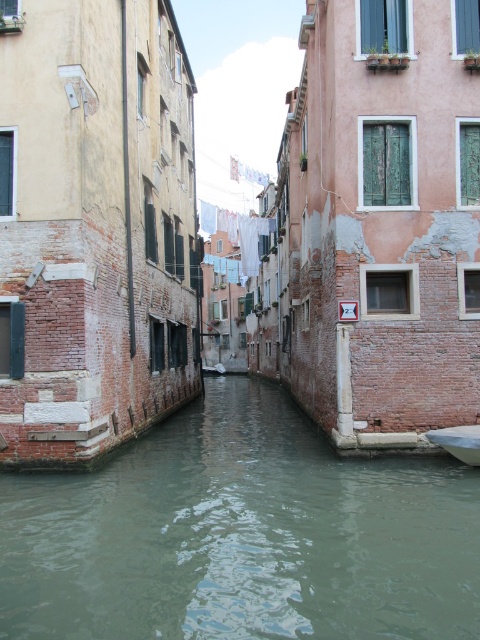
From the picture: You are standing on the left bank of the canal and want to cross to the right bank using the white glossy boat at lower right. Can you see the greenish water at center from your current position?

Yes, since the greenish water at center is to the left of the white glossy boat at lower right, you can see it from the left bank position.